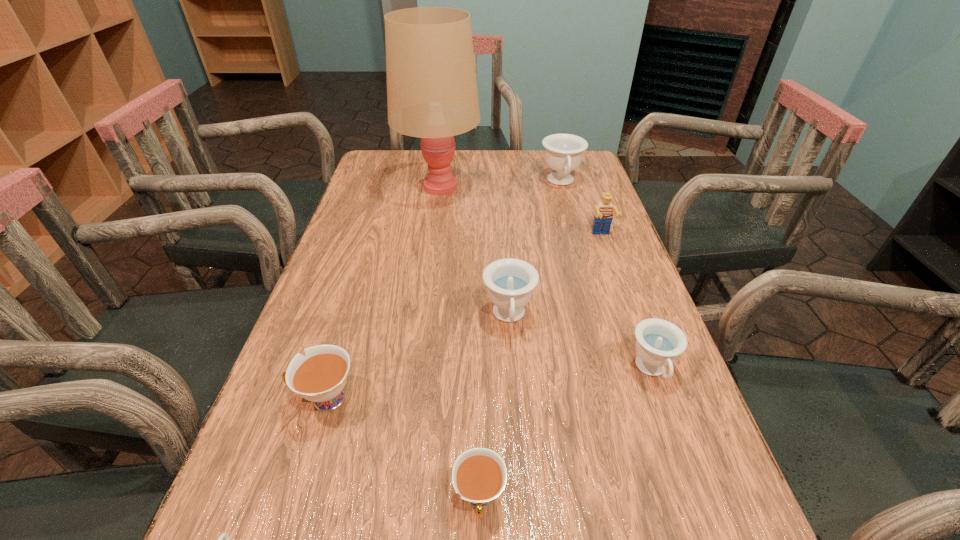
The height and width of the screenshot is (540, 960). What are the coordinates of `the third biggest blue teacup` in the screenshot? It's located at (658, 342).

Identify the location of the seventh farthest object. The image size is (960, 540). [479, 475].

Locate an element on the screen. This screenshot has height=540, width=960. the right white teacup is located at coordinates (479, 475).

You are a GUI agent. You are given a task and a screenshot of the screen. Output one action in this format:
    pyautogui.click(x=<x>, y=<y>)
    Task: Click on the free region located on the right of the pink lampshade
    Image resolution: width=960 pixels, height=540 pixels.
    Given the screenshot: What is the action you would take?
    pyautogui.click(x=506, y=186)

Where is `free spot located on the side of the biggest blue teacup with the handle`? Image resolution: width=960 pixels, height=540 pixels. free spot located on the side of the biggest blue teacup with the handle is located at coordinates (578, 241).

Locate an element on the screen. free location located on the face of the third farthest object is located at coordinates (610, 259).

This screenshot has height=540, width=960. I want to click on vacant space located 0.340m on the side of the fourth farthest object with the handle, so click(523, 524).

I want to click on blank space located 0.220m on the side of the third biggest blue teacup with the handle, so click(709, 529).

The height and width of the screenshot is (540, 960). I want to click on lampshade that is positioned at the far edge, so click(x=432, y=94).

I want to click on teacup located at the far edge, so click(563, 152).